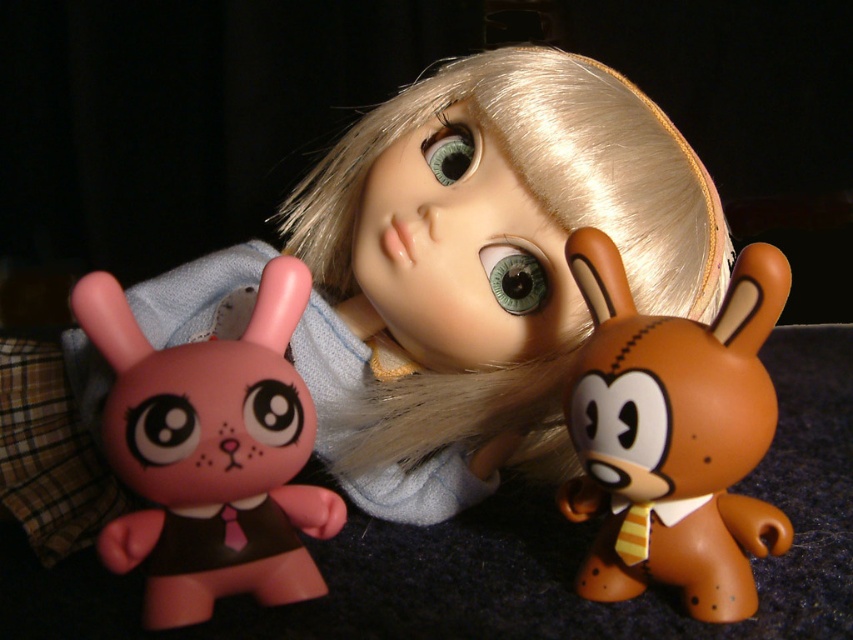
You are organizing a toy shelf and want to place the matte plastic doll at center and the brown matte plush toy at center side by side. If the shelf has a total width of 15 cm, and the doll is wider than the plush toy, can both fit without overlapping?

The matte plastic doll at center is wider than the brown matte plush toy at center. However, since the exact widths are not provided, we cannot determine if both will fit within 15 cm. More information is needed about their individual widths.

You are a child trying to arrange your toys. You have two points marked as part of a game. The first point is at coordinate point(675, 365) and the second is at point(305, 513). According to the image, which point is closer to you?

Point(675, 365) is in front of point(305, 513), so it is closer to you.

You are a child trying to decide which toy to pick up first. The brown matte plush toy at center and the matte pink plastic bunny at left are both on the table. Which one is bigger?

The brown matte plush toy at center is larger in size than the matte pink plastic bunny at left, so you should pick up the brown matte plush toy at center first since it is bigger.